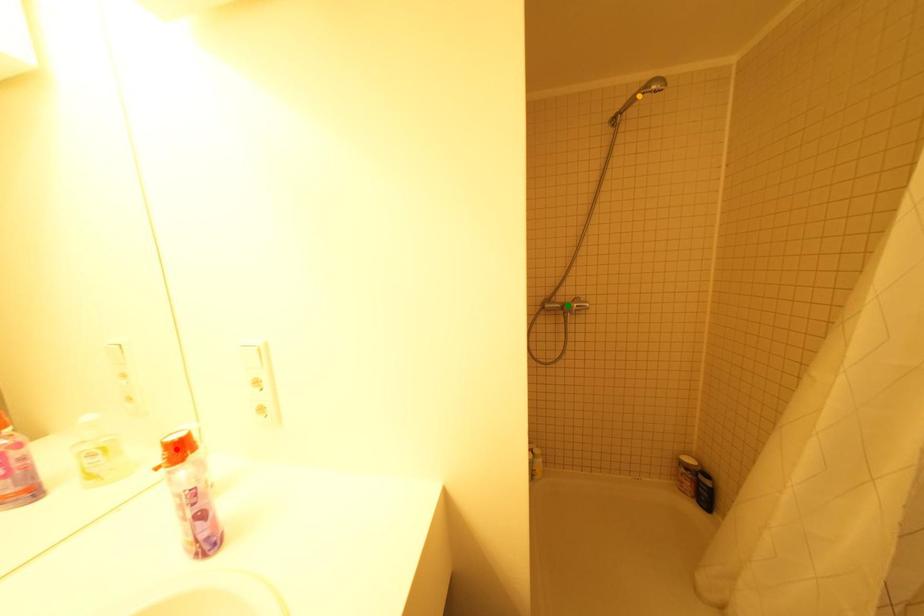
Order these from nearest to farthest:
orange point | green point | red point

1. red point
2. orange point
3. green point